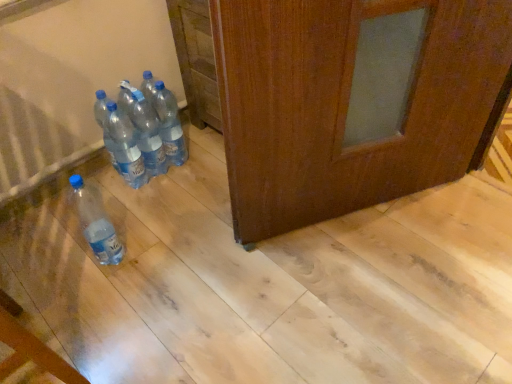
Locate an element on the screen. This screenshot has height=384, width=512. vacant region in front of transparent plastic bottles at center, arranged as the 2th bottle when viewed from the right is located at coordinates (157, 201).